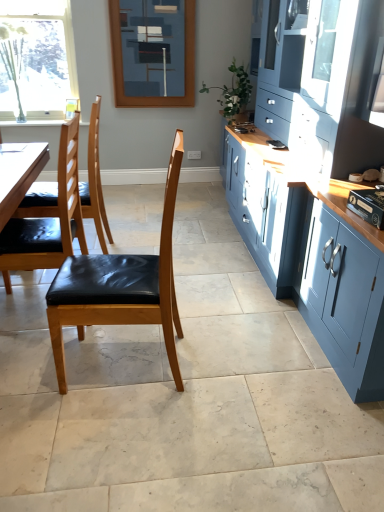
Question: Can you confirm if matte blue cabinet at right is shorter than matte black chair at left, arranged as the 2th chair when viewed from the back?

Choices:
 (A) yes
 (B) no

Answer: (B)

Question: Would you consider matte blue cabinet at right to be distant from matte black chair at left, arranged as the 2th chair when viewed from the back?

Choices:
 (A) no
 (B) yes

Answer: (B)

Question: Does matte blue cabinet at right come in front of matte black chair at left, arranged as the 2th chair when viewed from the back?

Choices:
 (A) yes
 (B) no

Answer: (A)

Question: Considering the relative sizes of matte blue cabinet at right and matte black chair at left, arranged as the 2th chair when viewed from the back, in the image provided, is matte blue cabinet at right smaller than matte black chair at left, arranged as the 2th chair when viewed from the back,?

Choices:
 (A) no
 (B) yes

Answer: (A)

Question: Is matte blue cabinet at right located outside matte black chair at left, placed as the second chair when sorted from front to back?

Choices:
 (A) no
 (B) yes

Answer: (B)

Question: Considering the positions of point (33, 38) and point (178, 38), is point (33, 38) closer or farther from the camera than point (178, 38)?

Choices:
 (A) farther
 (B) closer

Answer: (A)

Question: Visually, is clear glass window at upper left positioned to the left or to the right of blue painted wood frame at upper center?

Choices:
 (A) left
 (B) right

Answer: (A)

Question: From a real-world perspective, is clear glass window at upper left positioned above or below blue painted wood frame at upper center?

Choices:
 (A) below
 (B) above

Answer: (A)

Question: In the image, is clear glass window at upper left positioned in front of or behind blue painted wood frame at upper center?

Choices:
 (A) behind
 (B) front

Answer: (A)

Question: Is black leather chair at left, which ranks as the 1th chair in back-to-front order, to the left or to the right of matte black chair at left, arranged as the 2th chair when viewed from the back, in the image?

Choices:
 (A) left
 (B) right

Answer: (A)

Question: In terms of height, does black leather chair at left, which ranks as the 1th chair in back-to-front order, look taller or shorter compared to matte black chair at left, arranged as the 2th chair when viewed from the back?

Choices:
 (A) short
 (B) tall

Answer: (B)

Question: From the image's perspective, is black leather chair at left, positioned as the 3th chair in front-to-back order, located above or below matte black chair at left, placed as the second chair when sorted from front to back?

Choices:
 (A) above
 (B) below

Answer: (A)

Question: In terms of width, does black leather chair at left, positioned as the 3th chair in front-to-back order, look wider or thinner when compared to matte black chair at left, arranged as the 2th chair when viewed from the back?

Choices:
 (A) thin
 (B) wide

Answer: (A)

Question: From their relative heights in the image, would you say matte black chair at left, placed as the second chair when sorted from front to back, is taller or shorter than blue painted wood frame at upper center?

Choices:
 (A) short
 (B) tall

Answer: (B)

Question: Does point (69, 133) appear closer or farther from the camera than point (153, 73)?

Choices:
 (A) farther
 (B) closer

Answer: (B)